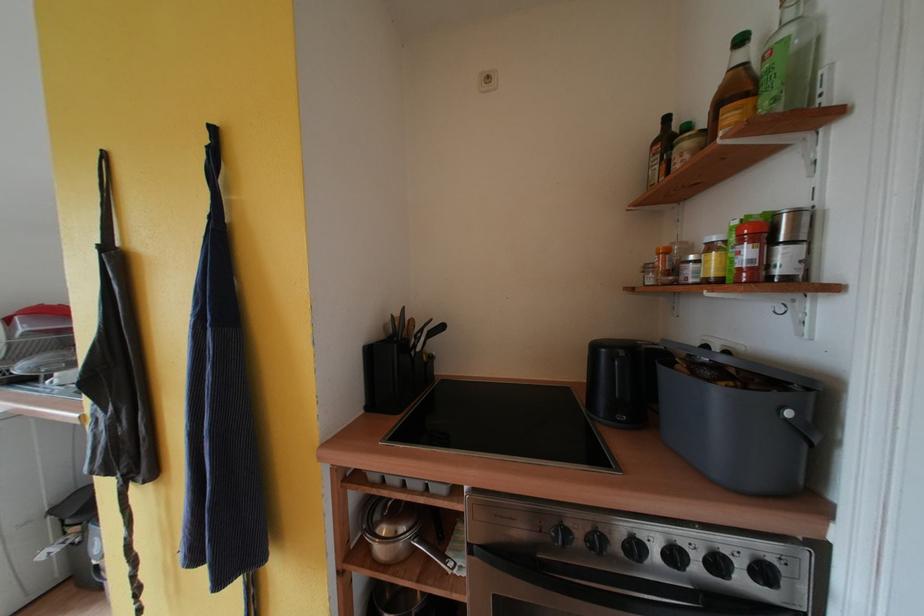
Find the location of a particular element. oven door handle is located at coordinates (585, 591).